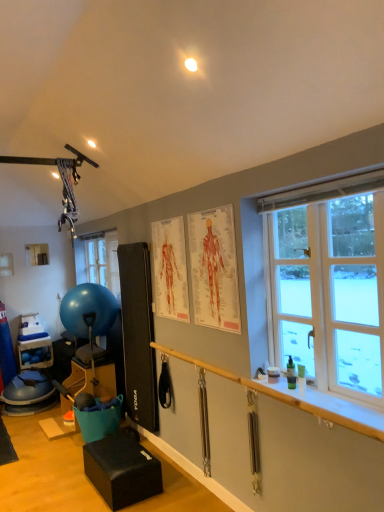
Question: From the image's perspective, is white glass window at right positioned above or below blue rubber ball at left?

Choices:
 (A) above
 (B) below

Answer: (A)

Question: Considering the positions of point (375, 236) and point (115, 312), is point (375, 236) closer or farther from the camera than point (115, 312)?

Choices:
 (A) farther
 (B) closer

Answer: (B)

Question: Considering the real-world distances, which object is closest to the white plastic window sill at lower right?

Choices:
 (A) blue plastic bucket at lower left
 (B) wooden rail at lower right
 (C) blue rubber ball at left
 (D) black leather cushion at lower center, acting as the 2th furniture starting from the back
 (E) matte black exercise ball at left, arranged as the 2th furniture when viewed from the front

Answer: (B)

Question: Which is nearer to the white plastic window sill at lower right?

Choices:
 (A) black leather cushion at lower center, which ranks as the first furniture in right-to-left order
 (B) blue rubber ball at left
 (C) matte black exercise ball at left, which is the first furniture from back to front
 (D) blue plastic bucket at lower left
 (E) white glass window at right

Answer: (E)